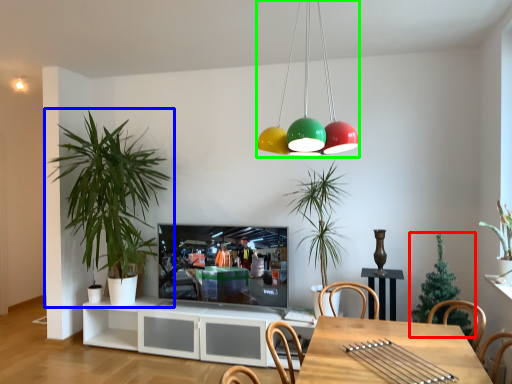
Question: Which object is positioned closest to houseplant (highlighted by a red box)? Select from houseplant (highlighted by a blue box) and chandelier (highlighted by a green box).

Choices:
 (A) houseplant
 (B) chandelier

Answer: (B)